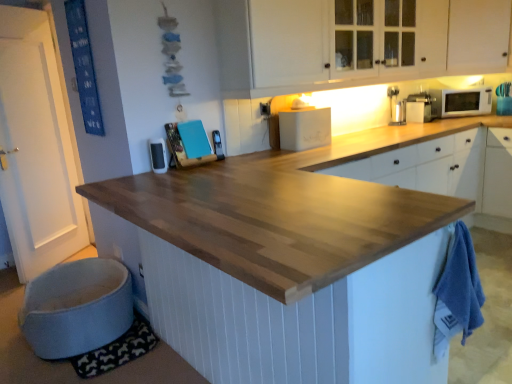
This screenshot has height=384, width=512. I want to click on free space in front of metallic silver phone at center, which is the 3th appliance from right to left, so click(211, 160).